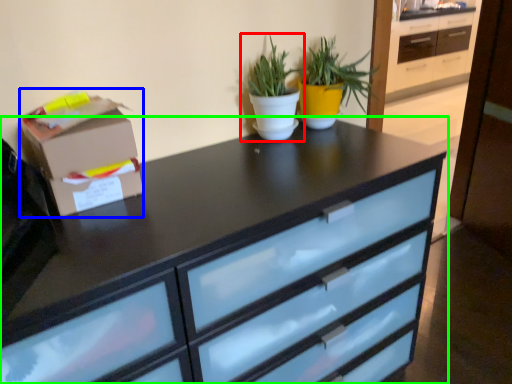
Question: Considering the real-world distances, which object is closest to houseplant (highlighted by a red box)? cardboard box (highlighted by a blue box) or chest of drawers (highlighted by a green box).

Choices:
 (A) cardboard box
 (B) chest of drawers

Answer: (B)